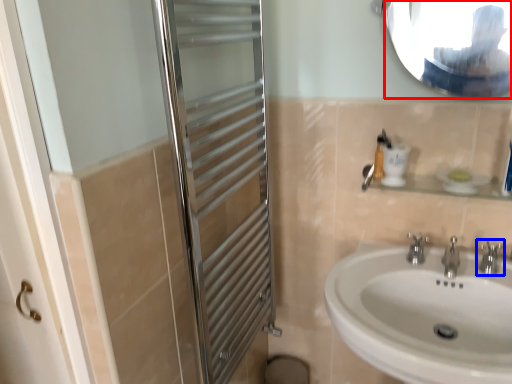
Question: Which of the following is the closest to the observer, mirror (highlighted by a red box) or tap (highlighted by a blue box)?

Choices:
 (A) mirror
 (B) tap

Answer: (A)